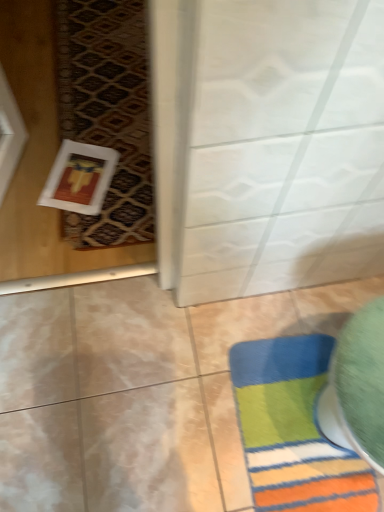
What is the approximate height of multicolored plush bath mat at lower right?

It is 0.63 inches.

What are the coordinates of `multicolored plush bath mat at lower right` in the screenshot? It's located at (294, 430).

In order to face multicolored plush bath mat at lower right, should I rotate leftwards or rightwards?

To face it directly, rotate right by 14.490 degrees.

Describe the element at coordinates (294, 430) in the screenshot. I see `multicolored plush bath mat at lower right` at that location.

The width and height of the screenshot is (384, 512). Find the location of `white textured mat at left`. white textured mat at left is located at coordinates (107, 112).

Describe the element at coordinates (107, 112) in the screenshot. The height and width of the screenshot is (512, 384). I see `white textured mat at left` at that location.

Identify the location of multicolored plush bath mat at lower right. (294, 430).

Can you confirm if multicolored plush bath mat at lower right is positioned to the right of white textured mat at left?

Yes, multicolored plush bath mat at lower right is to the right of white textured mat at left.

Is multicolored plush bath mat at lower right in front of or behind white textured mat at left in the image?

In the image, multicolored plush bath mat at lower right appears in front of white textured mat at left.

Is point (306, 353) positioned after point (84, 112)?

No.

From the image's perspective, would you say multicolored plush bath mat at lower right is positioned over white textured mat at left?

No.

From a real-world perspective, who is located lower, multicolored plush bath mat at lower right or white textured mat at left?

From a 3D spatial view, multicolored plush bath mat at lower right is below.

Can you confirm if multicolored plush bath mat at lower right is wider than white textured mat at left?

No, multicolored plush bath mat at lower right is not wider than white textured mat at left.

Does multicolored plush bath mat at lower right have a lesser height compared to white textured mat at left?

In fact, multicolored plush bath mat at lower right may be taller than white textured mat at left.

Considering the sizes of objects multicolored plush bath mat at lower right and white textured mat at left in the image provided, who is smaller, multicolored plush bath mat at lower right or white textured mat at left?

multicolored plush bath mat at lower right.

Is multicolored plush bath mat at lower right completely or partially outside of white textured mat at left?

Absolutely, multicolored plush bath mat at lower right is external to white textured mat at left.

Is multicolored plush bath mat at lower right positioned far away from white textured mat at left?

No, multicolored plush bath mat at lower right is not far from white textured mat at left.

Does multicolored plush bath mat at lower right turn towards white textured mat at left?

No, multicolored plush bath mat at lower right is not turned towards white textured mat at left.

How many degrees apart are the facing directions of multicolored plush bath mat at lower right and white textured mat at left?

There is a 87.9-degree angle between the facing directions of multicolored plush bath mat at lower right and white textured mat at left.

Image resolution: width=384 pixels, height=512 pixels. Find the location of `bath mat below the white textured mat at left (from a real-world perspective)`. bath mat below the white textured mat at left (from a real-world perspective) is located at coordinates [294, 430].

Which object is positioned more to the left, white textured mat at left or multicolored plush bath mat at lower right?

white textured mat at left is more to the left.

Considering their positions, is white textured mat at left located in front of or behind multicolored plush bath mat at lower right?

→ white textured mat at left is positioned farther from the viewer than multicolored plush bath mat at lower right.

Between point (120, 169) and point (304, 366), which one is positioned behind?

Point (120, 169)

From the image's perspective, is white textured mat at left located above or below multicolored plush bath mat at lower right?

white textured mat at left is above multicolored plush bath mat at lower right.

From a real-world perspective, is white textured mat at left located beneath multicolored plush bath mat at lower right?

No, from a real-world perspective, white textured mat at left is not below multicolored plush bath mat at lower right.

Can you confirm if white textured mat at left is wider than multicolored plush bath mat at lower right?

Indeed, white textured mat at left has a greater width compared to multicolored plush bath mat at lower right.

Looking at this image, does white textured mat at left have a greater height compared to multicolored plush bath mat at lower right?

No, white textured mat at left is not taller than multicolored plush bath mat at lower right.

Can you confirm if white textured mat at left is smaller than multicolored plush bath mat at lower right?

No, white textured mat at left is not smaller than multicolored plush bath mat at lower right.

Is white textured mat at left not inside multicolored plush bath mat at lower right?

white textured mat at left lies outside multicolored plush bath mat at lower right's area.

Is white textured mat at left touching multicolored plush bath mat at lower right?

There is a gap between white textured mat at left and multicolored plush bath mat at lower right.

Is white textured mat at left oriented towards multicolored plush bath mat at lower right?

No.

This screenshot has width=384, height=512. Find the location of `bath mat below the white textured mat at left (from the image's perspective)`. bath mat below the white textured mat at left (from the image's perspective) is located at coordinates (294, 430).

Image resolution: width=384 pixels, height=512 pixels. I want to click on bath mat located in front of the white textured mat at left, so click(294, 430).

The height and width of the screenshot is (512, 384). In order to click on mat positioned vertically above the multicolored plush bath mat at lower right (from a real-world perspective) in this screenshot , I will do tap(107, 112).